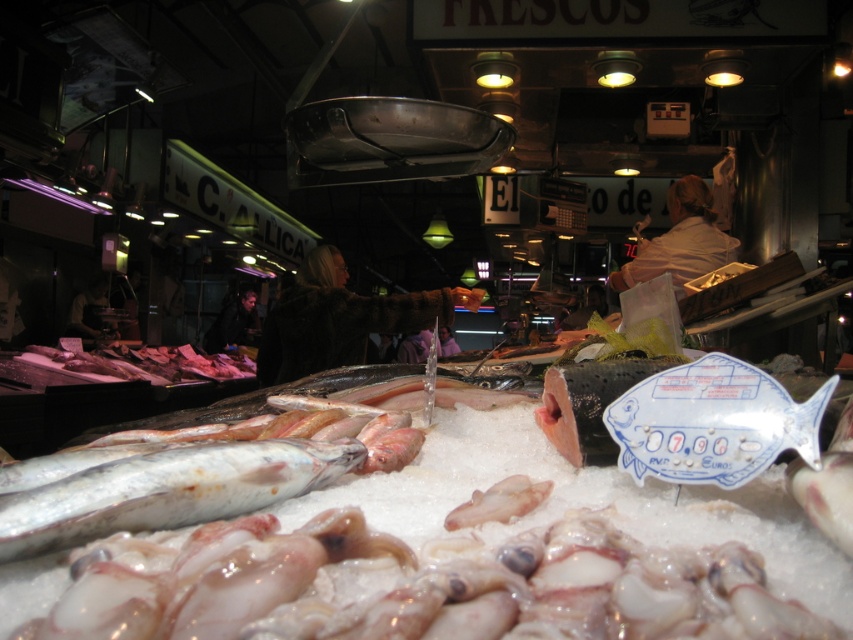
Describe the element at coordinates (167, 490) in the screenshot. I see `translucent white fish at center` at that location.

Does translucent white fish at center lie behind translucent pinkish flesh at center?

No, translucent white fish at center is in front of translucent pinkish flesh at center.

Which is in front, point (85, 468) or point (527, 492)?

Point (85, 468)

Locate an element on the screen. translucent white fish at center is located at coordinates (167, 490).